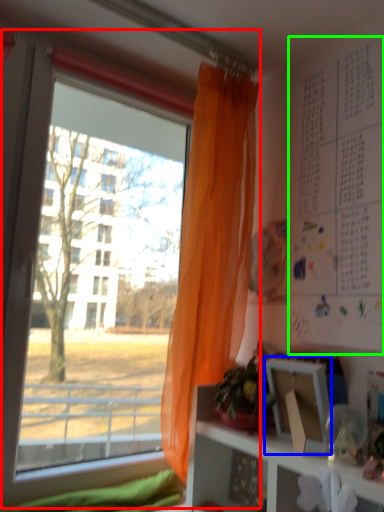
Question: Which is farther away from window (highlighted by a red box)? picture frame (highlighted by a blue box) or bulletin board (highlighted by a green box)?

Choices:
 (A) picture frame
 (B) bulletin board

Answer: (A)